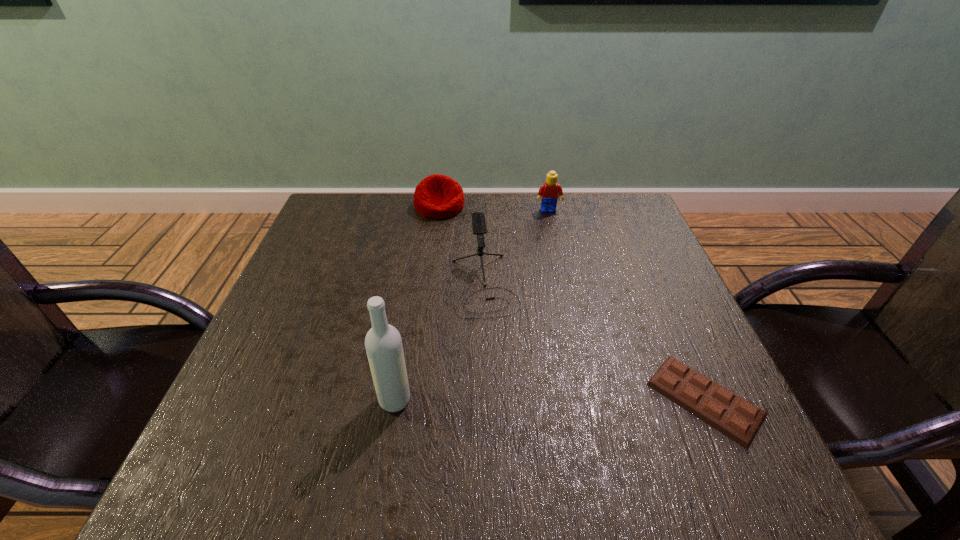
Identify the location of chocolate bar at the near edge. This screenshot has width=960, height=540. (730, 414).

Locate an element on the screen. This screenshot has height=540, width=960. object at the right edge is located at coordinates (730, 414).

Where is `object located at the near right corner`? The height and width of the screenshot is (540, 960). object located at the near right corner is located at coordinates (730, 414).

In the image, there is a desktop. Find the location of `vacant space at the far edge`. vacant space at the far edge is located at coordinates (404, 208).

At what (x,y) coordinates should I click in order to perform the action: click on vacant area at the near edge of the desktop. Please return your answer as a coordinate pair (x, y). This screenshot has height=540, width=960. Looking at the image, I should click on (356, 429).

In the image, there is a desktop. What are the coordinates of `vacant region at the left edge` in the screenshot? It's located at tap(342, 311).

Find the location of a particular element. The width and height of the screenshot is (960, 540). vacant space at the far left corner of the desktop is located at coordinates (324, 218).

Find the location of `vacant area at the far right corner`. vacant area at the far right corner is located at coordinates 623,236.

In order to click on vacant area between the chocolate bar and the third nearest object in this screenshot , I will do click(595, 342).

You are a GUI agent. You are given a task and a screenshot of the screen. Output one action in this format:
    pyautogui.click(x=<x>, y=<y>)
    Task: Click on the empty location between the microphone and the Lego
    The width and height of the screenshot is (960, 540).
    Given the screenshot: What is the action you would take?
    (x=516, y=248)